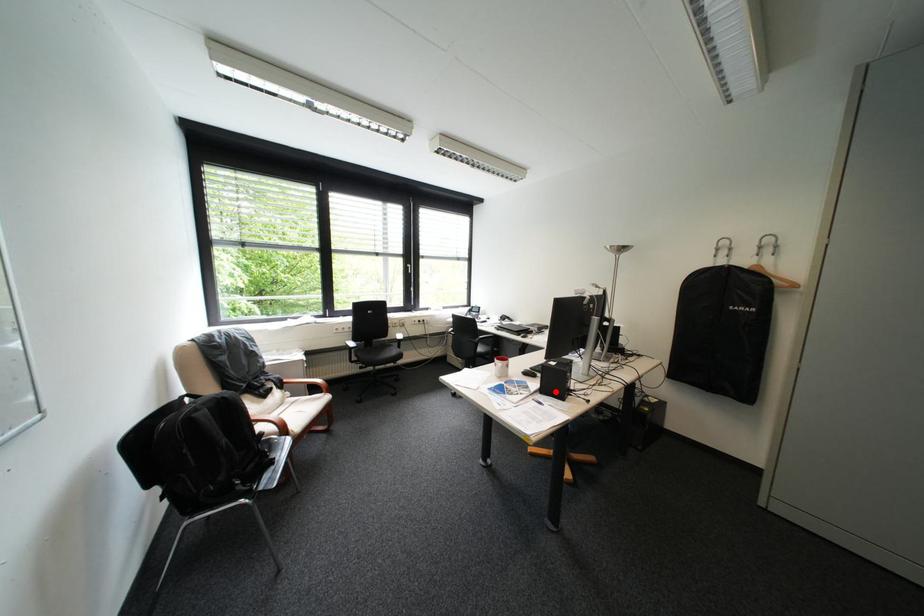
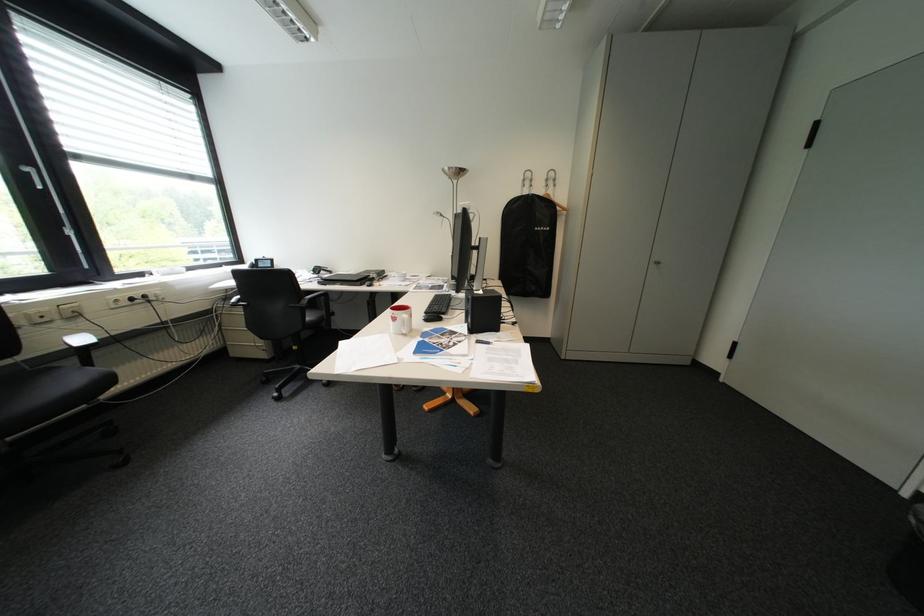
Find the pixel in the second image that matches the highlighted location in the first image.

(484, 331)